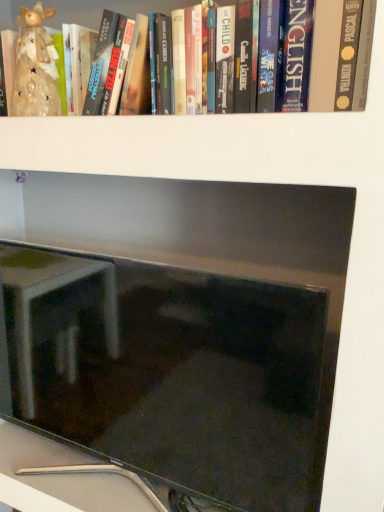
Question: Is matte ceramic figurine at upper left far away from matte black monitor at center?

Choices:
 (A) yes
 (B) no

Answer: (B)

Question: From the image's perspective, would you say matte ceramic figurine at upper left is shown under matte black monitor at center?

Choices:
 (A) no
 (B) yes

Answer: (A)

Question: Is matte ceramic figurine at upper left in front of matte black monitor at center?

Choices:
 (A) yes
 (B) no

Answer: (B)

Question: Would you say matte black monitor at center is part of matte ceramic figurine at upper left's contents?

Choices:
 (A) no
 (B) yes

Answer: (A)

Question: Is matte ceramic figurine at upper left next to matte black monitor at center and touching it?

Choices:
 (A) no
 (B) yes

Answer: (A)

Question: Considering the relative sizes of matte ceramic figurine at upper left and matte black monitor at center in the image provided, is matte ceramic figurine at upper left smaller than matte black monitor at center?

Choices:
 (A) no
 (B) yes

Answer: (B)

Question: Is matte ceramic figurine at upper left at the left side of hardcover book at upper center?

Choices:
 (A) yes
 (B) no

Answer: (A)

Question: Can you confirm if matte ceramic figurine at upper left is thinner than hardcover book at upper center?

Choices:
 (A) yes
 (B) no

Answer: (A)

Question: From the image's perspective, would you say matte ceramic figurine at upper left is shown under hardcover book at upper center?

Choices:
 (A) yes
 (B) no

Answer: (A)

Question: Considering the relative sizes of matte ceramic figurine at upper left and hardcover book at upper center in the image provided, is matte ceramic figurine at upper left shorter than hardcover book at upper center?

Choices:
 (A) yes
 (B) no

Answer: (B)

Question: From the image's perspective, is matte ceramic figurine at upper left on hardcover book at upper center?

Choices:
 (A) no
 (B) yes

Answer: (A)

Question: From a real-world perspective, is matte ceramic figurine at upper left located beneath hardcover book at upper center?

Choices:
 (A) yes
 (B) no

Answer: (A)

Question: From the image's perspective, would you say matte black monitor at center is positioned over hardcover book at upper center?

Choices:
 (A) yes
 (B) no

Answer: (B)